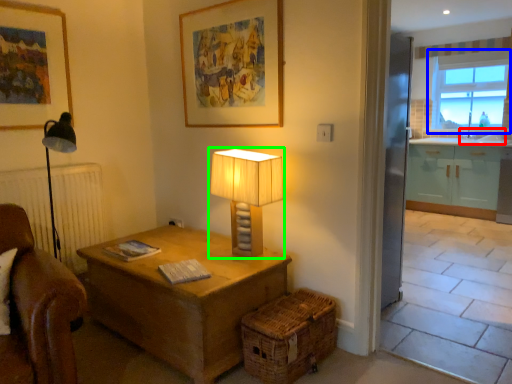
Question: Which object is the closest to the sink (highlighted by a red box)? Choose among these: window (highlighted by a blue box) or lamp (highlighted by a green box).

Choices:
 (A) window
 (B) lamp

Answer: (A)